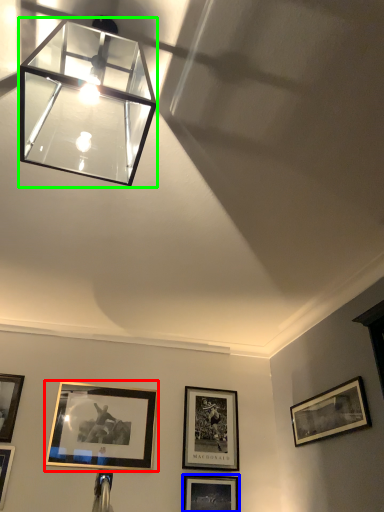
Question: Estimate the real-world distances between objects in this image. Which object is closer to picture frame (highlighted by a red box), picture frame (highlighted by a blue box) or lamp (highlighted by a green box)?

Choices:
 (A) picture frame
 (B) lamp

Answer: (A)